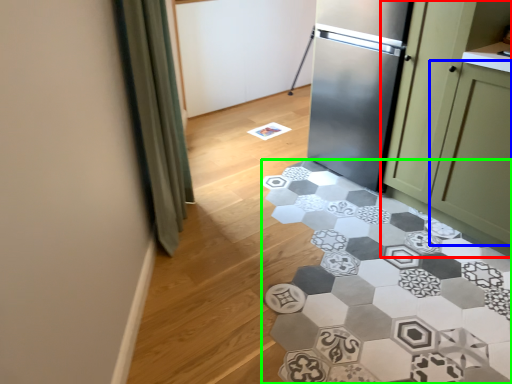
Question: Which is nearer to the cabinetry (highlighted by a red box)? glass door (highlighted by a blue box) or marble (highlighted by a green box).

Choices:
 (A) glass door
 (B) marble

Answer: (A)